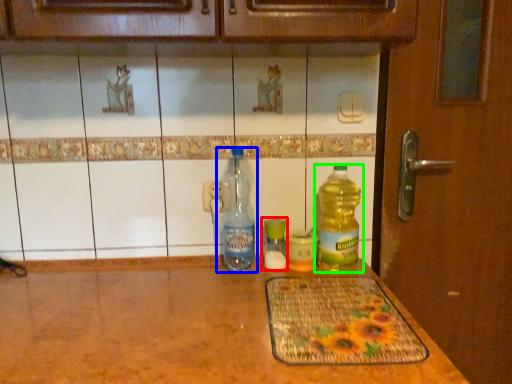
Question: Which object is positioned closest to bottle (highlighted by a red box)? Select from bottle (highlighted by a blue box) and bottle (highlighted by a green box).

Choices:
 (A) bottle
 (B) bottle

Answer: (A)